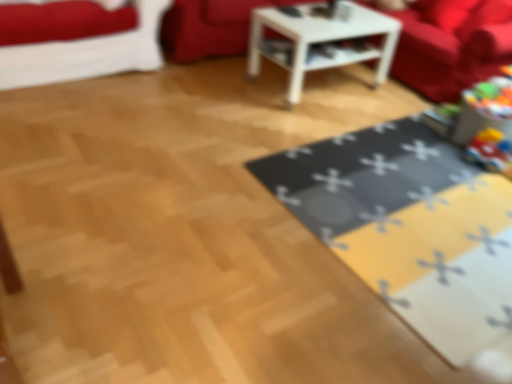
What do you see at coordinates (452, 49) in the screenshot? I see `velvet red couch at upper right, placed as the first couch when sorted from right to left` at bounding box center [452, 49].

Looking at this image, measure the distance between point [194,26] and camera.

They are 11.02 feet apart.

What do you see at coordinates (409, 226) in the screenshot? I see `yellow fabric mat at lower right` at bounding box center [409, 226].

I want to click on white glossy table at center, so click(321, 41).

This screenshot has height=384, width=512. What are the coordinates of `velvet red couch at upper right, placed as the first couch when sorted from right to left` in the screenshot? It's located at (452, 49).

Which object is closer to the camera taking this photo, velvet red couch at upper right, placed as the first couch when sorted from right to left, or velvet red couch at upper center, which appears as the second couch when viewed from the right?

velvet red couch at upper right, placed as the first couch when sorted from right to left, is closer to the camera.

Which is behind, point (466, 46) or point (201, 7)?

The point (201, 7) is farther from the camera.

Is velvet red couch at upper right, placed as the first couch when sorted from right to left, with velvet red couch at upper center, which ranks as the 1th couch in left-to-right order?

No, velvet red couch at upper right, placed as the first couch when sorted from right to left, is not with velvet red couch at upper center, which ranks as the 1th couch in left-to-right order.

Based on the photo, could you measure the distance between velvet red couch at upper right, placed as the first couch when sorted from right to left, and velvet red couch at upper center, which ranks as the 1th couch in left-to-right order?

4.62 feet.

Can you see velvet red couch at upper left touching white glossy table at center?

No.

Between velvet red couch at upper left and white glossy table at center, which one has smaller width?

velvet red couch at upper left.

Looking at this image, between velvet red couch at upper left and white glossy table at center, which one appears on the left side from the viewer's perspective?

velvet red couch at upper left.

From a real-world perspective, is velvet red couch at upper left located beneath white glossy table at center?

No, from a real-world perspective, velvet red couch at upper left is not under white glossy table at center.

Can you confirm if velvet red couch at upper left is bigger than velvet red couch at upper center, which appears as the second couch when viewed from the right?

Result: No, velvet red couch at upper left is not bigger than velvet red couch at upper center, which appears as the second couch when viewed from the right.

From the image's perspective, which is above, velvet red couch at upper left or velvet red couch at upper center, which ranks as the 1th couch in left-to-right order?

velvet red couch at upper center, which ranks as the 1th couch in left-to-right order, is shown above in the image.

From a real-world perspective, is velvet red couch at upper left below velvet red couch at upper center, which ranks as the 1th couch in left-to-right order?

No, from a real-world perspective, velvet red couch at upper left is not under velvet red couch at upper center, which ranks as the 1th couch in left-to-right order.

Consider the image. Is velvet red couch at upper left at the left side of velvet red couch at upper center, which ranks as the 1th couch in left-to-right order?

Yes, velvet red couch at upper left is to the left of velvet red couch at upper center, which ranks as the 1th couch in left-to-right order.

In terms of height, does velvet red couch at upper right, placed as the first couch when sorted from right to left, look taller or shorter compared to velvet red couch at upper left?

Clearly, velvet red couch at upper right, placed as the first couch when sorted from right to left, is taller compared to velvet red couch at upper left.

Identify the location of studio couch in front of the velvet red couch at upper right, placed as the first couch when sorted from right to left. (87, 54).

Is velvet red couch at upper right, the second couch viewed from the left, bigger than velvet red couch at upper left?

Yes.

How much distance is there between velvet red couch at upper right, the second couch viewed from the left, and velvet red couch at upper left?

velvet red couch at upper right, the second couch viewed from the left, is 7.44 feet away from velvet red couch at upper left.

From a real-world perspective, which is physically above, velvet red couch at upper left or yellow fabric mat at lower right?

From a 3D spatial view, velvet red couch at upper left is above.

From the image's perspective, is velvet red couch at upper left located beneath yellow fabric mat at lower right?

Actually, velvet red couch at upper left appears above yellow fabric mat at lower right in the image.

Considering the relative sizes of velvet red couch at upper left and yellow fabric mat at lower right in the image provided, is velvet red couch at upper left smaller than yellow fabric mat at lower right?

No.

Consider the image. Who is taller, velvet red couch at upper left or yellow fabric mat at lower right?

velvet red couch at upper left.

Is yellow fabric mat at lower right in contact with velvet red couch at upper right, the second couch viewed from the left?

There is a gap between yellow fabric mat at lower right and velvet red couch at upper right, the second couch viewed from the left.

Which point is more forward, (x=423, y=174) or (x=497, y=45)?

Positioned in front is point (x=423, y=174).

Does yellow fabric mat at lower right turn towards velvet red couch at upper right, placed as the first couch when sorted from right to left?

No, yellow fabric mat at lower right is not oriented towards velvet red couch at upper right, placed as the first couch when sorted from right to left.

This screenshot has width=512, height=384. Find the location of `table above the yellow fabric mat at lower right (from the image's perspective)`. table above the yellow fabric mat at lower right (from the image's perspective) is located at coordinates (321, 41).

Is yellow fabric mat at lower right bigger or smaller than white glossy table at center?

Clearly, yellow fabric mat at lower right is smaller in size than white glossy table at center.

Is point (273, 188) positioned after point (270, 14)?

No, (273, 188) is closer to viewer.

In the image, is yellow fabric mat at lower right positioned in front of or behind white glossy table at center?

yellow fabric mat at lower right is in front of white glossy table at center.

Locate an element on the screen. This screenshot has width=512, height=384. couch on the left of velvet red couch at upper right, placed as the first couch when sorted from right to left is located at coordinates (211, 27).

Image resolution: width=512 pixels, height=384 pixels. Identify the location of studio couch above the white glossy table at center (from a real-world perspective). (87, 54).

Considering their positions, is velvet red couch at upper right, placed as the first couch when sorted from right to left, positioned further to white glossy table at center than velvet red couch at upper left?

velvet red couch at upper left is further to white glossy table at center.

From the image, which object appears to be farther from velvet red couch at upper left, velvet red couch at upper center, which appears as the second couch when viewed from the right, or yellow fabric mat at lower right?

Among the two, yellow fabric mat at lower right is located further to velvet red couch at upper left.

When comparing their distances from velvet red couch at upper left, does white glossy table at center or yellow fabric mat at lower right seem further?

yellow fabric mat at lower right.

Based on the photo, which object lies nearer to the anchor point yellow fabric mat at lower right, white glossy table at center or velvet red couch at upper right, placed as the first couch when sorted from right to left?

Among the two, white glossy table at center is located nearer to yellow fabric mat at lower right.

From the picture: Which object lies further to the anchor point velvet red couch at upper center, which appears as the second couch when viewed from the right, yellow fabric mat at lower right or velvet red couch at upper right, the second couch viewed from the left?

Based on the image, yellow fabric mat at lower right appears to be further to velvet red couch at upper center, which appears as the second couch when viewed from the right.

When comparing their distances from white glossy table at center, does velvet red couch at upper left or yellow fabric mat at lower right seem closer?

yellow fabric mat at lower right lies closer to white glossy table at center than the other object.

Estimate the real-world distances between objects in this image. Which object is further from yellow fabric mat at lower right, velvet red couch at upper right, the second couch viewed from the left, or velvet red couch at upper center, which ranks as the 1th couch in left-to-right order?

Among the two, velvet red couch at upper center, which ranks as the 1th couch in left-to-right order, is located further to yellow fabric mat at lower right.

When comparing their distances from velvet red couch at upper center, which ranks as the 1th couch in left-to-right order, does yellow fabric mat at lower right or velvet red couch at upper left seem closer?

velvet red couch at upper left is closer to velvet red couch at upper center, which ranks as the 1th couch in left-to-right order.

The height and width of the screenshot is (384, 512). Identify the location of couch that lies between velvet red couch at upper center, which appears as the second couch when viewed from the right, and yellow fabric mat at lower right from top to bottom. (452, 49).

Identify the location of table located between velvet red couch at upper center, which ranks as the 1th couch in left-to-right order, and velvet red couch at upper right, the second couch viewed from the left, in the left-right direction. Image resolution: width=512 pixels, height=384 pixels. (321, 41).

Image resolution: width=512 pixels, height=384 pixels. In order to click on couch between velvet red couch at upper left and yellow fabric mat at lower right from left to right in this screenshot , I will do `click(211, 27)`.

The height and width of the screenshot is (384, 512). I want to click on table between velvet red couch at upper center, which ranks as the 1th couch in left-to-right order, and yellow fabric mat at lower right vertically, so click(321, 41).